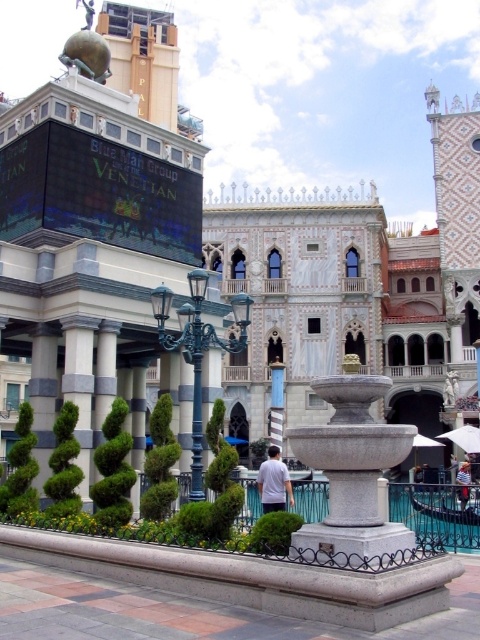
Between granite fountain at center and white fabric umbrella at center, which one is positioned lower?

Positioned lower is white fabric umbrella at center.

Does granite fountain at center have a greater height compared to white fabric umbrella at center?

Yes, granite fountain at center is taller than white fabric umbrella at center.

Between point (331, 428) and point (468, 452), which one is positioned behind?

The point (468, 452) is behind.

At what (x,y) coordinates should I click in order to perform the action: click on granite fountain at center. Please return your answer as a coordinate pair (x, y). Looking at the image, I should click on (351, 476).

Is granite fountain at center below white striped shirt at center?

Incorrect, granite fountain at center is not positioned below white striped shirt at center.

Which of these two, granite fountain at center or white striped shirt at center, stands taller?

granite fountain at center

Locate an element on the screen. granite fountain at center is located at coordinates (351, 476).

Where is `granite fountain at center`? This screenshot has width=480, height=640. granite fountain at center is located at coordinates 351,476.

Which is behind, point (345, 435) or point (285, 486)?

The point (285, 486) is more distant.

The width and height of the screenshot is (480, 640). Find the location of `granite fountain at center`. granite fountain at center is located at coordinates (351, 476).